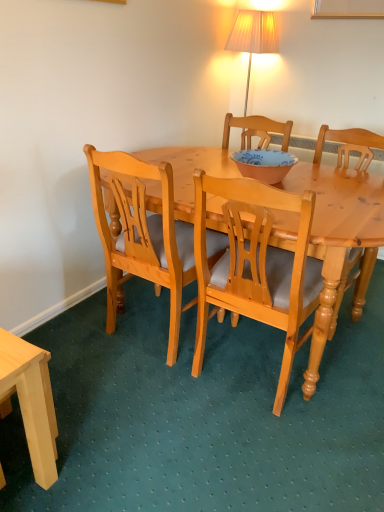
Question: In terms of width, does light wood desk at lower left look wider or thinner when compared to light brown wood chair at center, the first chair from the left?

Choices:
 (A) thin
 (B) wide

Answer: (A)

Question: Is point (48, 391) closer or farther from the camera than point (226, 242)?

Choices:
 (A) closer
 (B) farther

Answer: (A)

Question: Which object is the farthest from the light wood chair at center, which is counted as the second chair, starting from the left?

Choices:
 (A) matte pink bowl at center
 (B) light brown wood chair at center, acting as the third chair starting from the right
 (C) light wood chair at center, which is the 1th chair from right to left
 (D) light wood desk at lower left

Answer: (C)

Question: Which of these objects is positioned closest to the light brown wood chair at center, acting as the third chair starting from the right?

Choices:
 (A) light wood chair at center, which is the 1th chair from right to left
 (B) light wood chair at center, the second chair in the right-to-left sequence
 (C) matte pink bowl at center
 (D) light wood desk at lower left

Answer: (B)